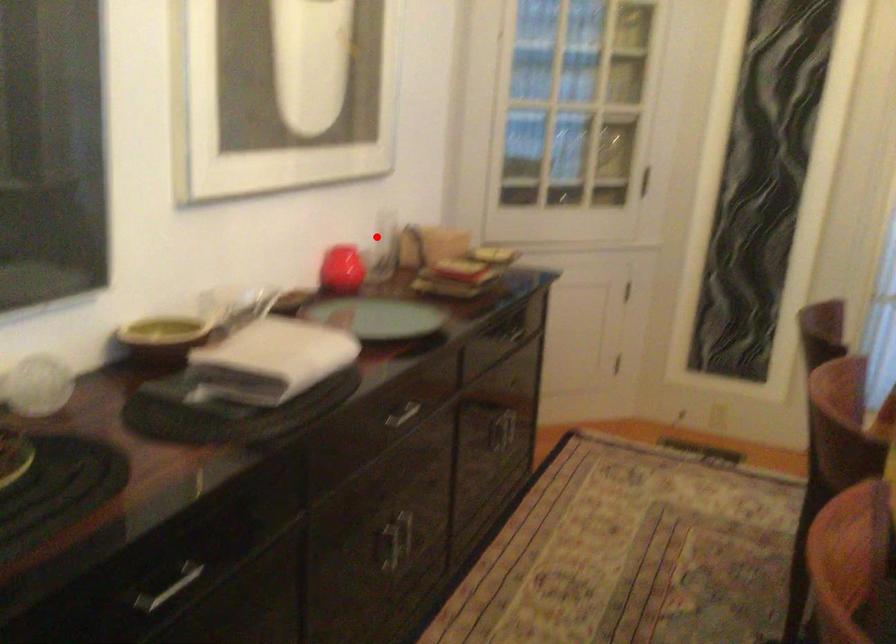
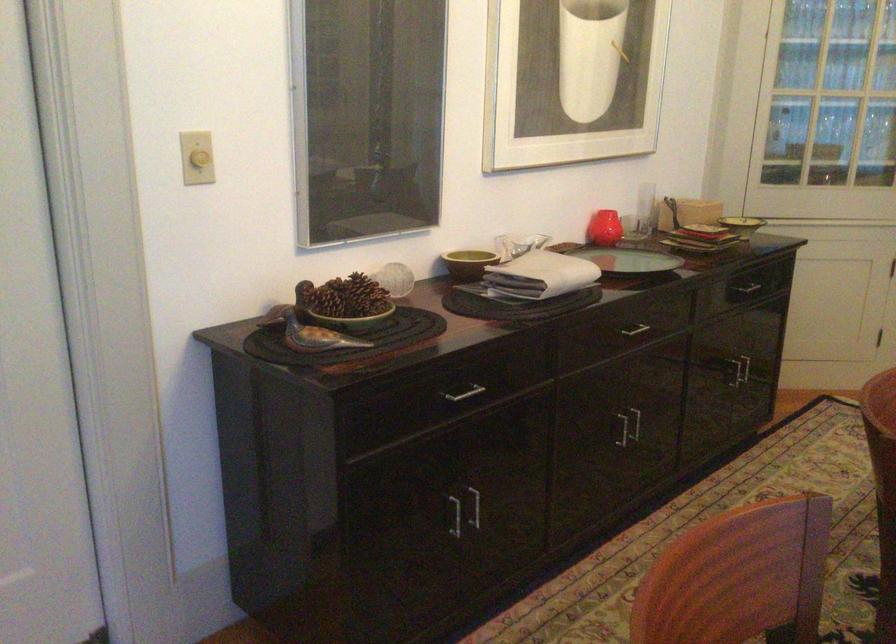
In the second image, find the point that corresponds to the highlighted location in the first image.

(645, 207)